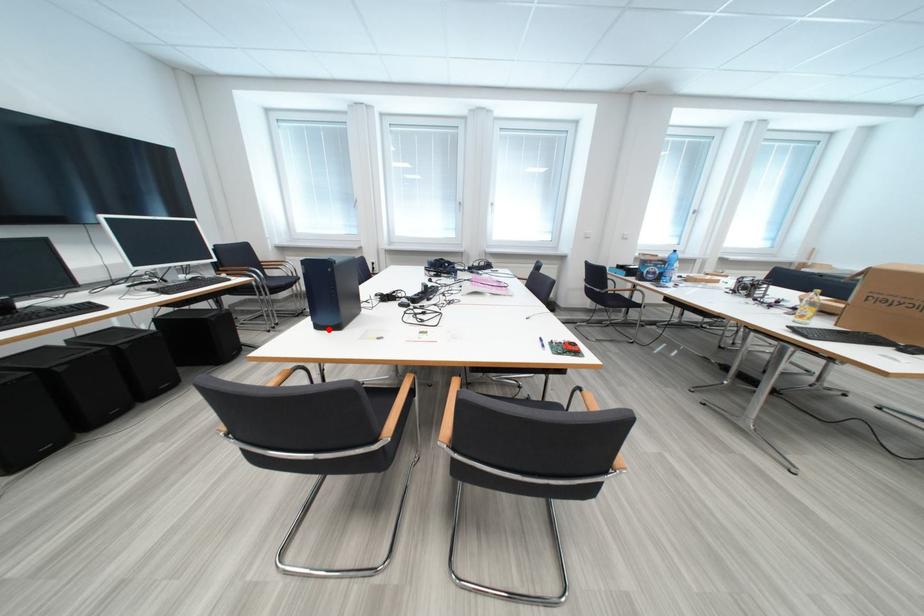
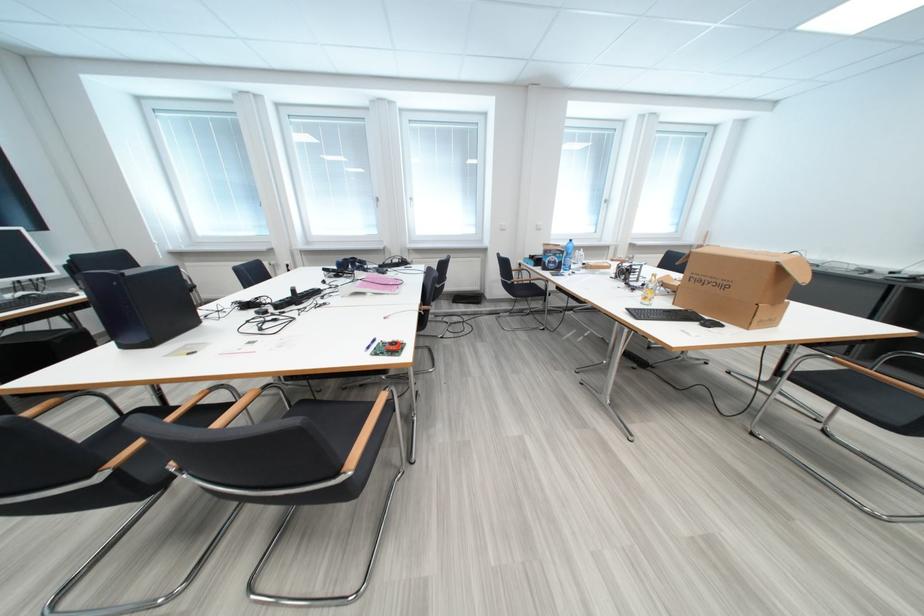
Where in the second image is the point corresponding to the highlighted location from the first image?

(136, 349)